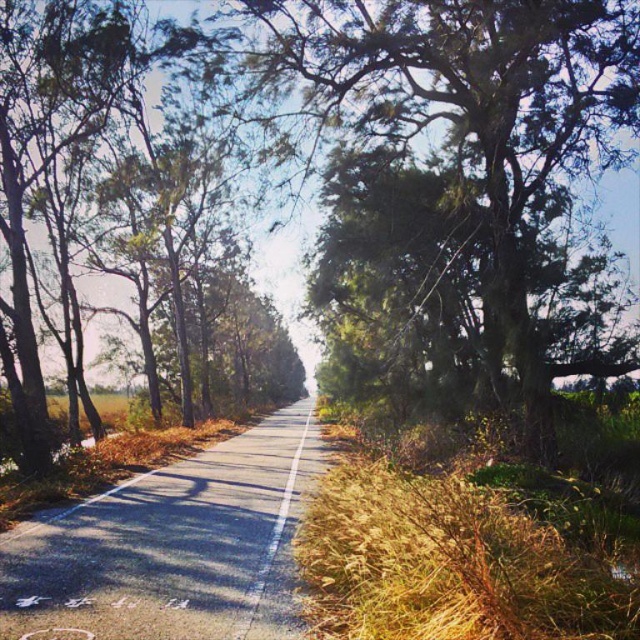
Question: Which point is closer to the camera?

Choices:
 (A) green mossy tree at center
 (B) dry grass at right

Answer: (B)

Question: Is green mossy tree at center smaller than dry grass at right?

Choices:
 (A) yes
 (B) no

Answer: (B)

Question: Is the position of dry grass at right more distant than that of green leafy tree at left?

Choices:
 (A) yes
 (B) no

Answer: (B)

Question: Estimate the real-world distances between objects in this image. Which object is farther from the green mossy tree at center?

Choices:
 (A) green leafy tree at left
 (B) dry grass at right

Answer: (B)

Question: Which point is farther to the camera?

Choices:
 (A) dry grass at right
 (B) green leafy tree at left

Answer: (B)

Question: Is green mossy tree at center thinner than dry grass at right?

Choices:
 (A) yes
 (B) no

Answer: (B)